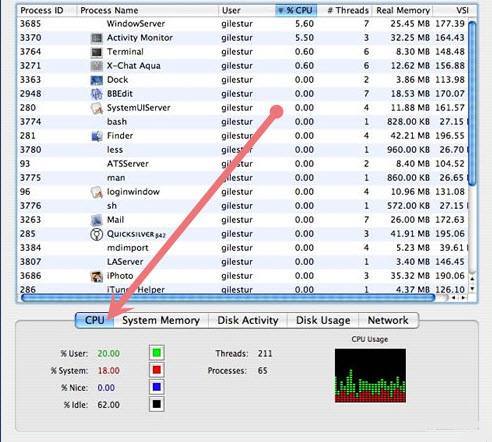
Find the location of a particular element. The width and height of the screenshot is (492, 442). columns is located at coordinates 47,7, 127,9, 231,7, 291,10, 352,7, 405,11, 461,9.